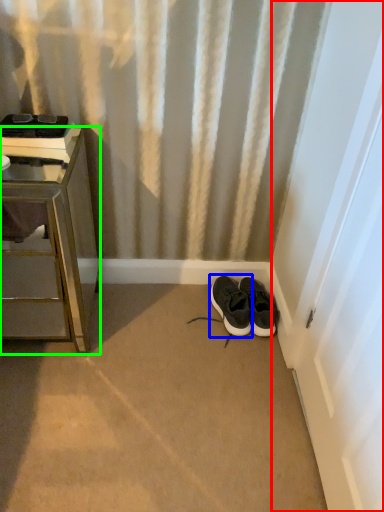
Question: Which object is positioned farthest from screen door (highlighted by a red box)? Select from footwear (highlighted by a blue box) and furniture (highlighted by a green box).

Choices:
 (A) footwear
 (B) furniture

Answer: (B)